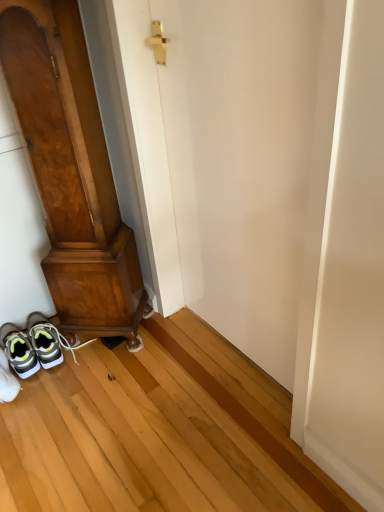
The image size is (384, 512). What are the coordinates of `free space in front of wooden door at left, the first door from the left` in the screenshot? It's located at (99, 380).